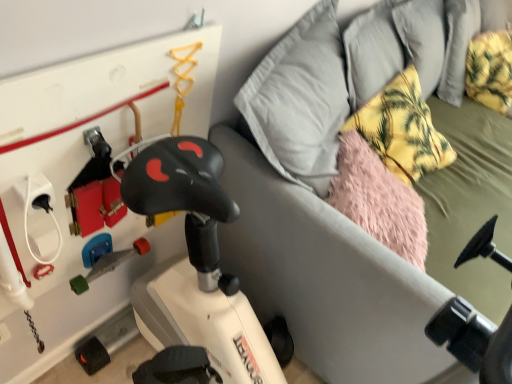
Question: Would you say yellow fabric pillow at upper right is outside white matte exercise bike at lower left?

Choices:
 (A) no
 (B) yes

Answer: (A)

Question: Is white matte exercise bike at lower left at the back of yellow fabric pillow at upper right?

Choices:
 (A) no
 (B) yes

Answer: (B)

Question: Considering the relative sizes of yellow fabric pillow at upper right and white matte exercise bike at lower left in the image provided, is yellow fabric pillow at upper right thinner than white matte exercise bike at lower left?

Choices:
 (A) no
 (B) yes

Answer: (B)

Question: Are yellow fabric pillow at upper right and white matte exercise bike at lower left located far from each other?

Choices:
 (A) yes
 (B) no

Answer: (B)

Question: From a real-world perspective, is yellow fabric pillow at upper right positioned under white matte exercise bike at lower left based on gravity?

Choices:
 (A) no
 (B) yes

Answer: (A)

Question: Is white matte exercise bike at lower left inside yellow fabric pillow at upper right?

Choices:
 (A) no
 (B) yes

Answer: (A)

Question: Is white matte exercise bike at lower left facing away from yellow fabric pillow at upper right?

Choices:
 (A) no
 (B) yes

Answer: (B)

Question: Considering the relative sizes of white matte exercise bike at lower left and yellow fabric pillow at upper right in the image provided, is white matte exercise bike at lower left shorter than yellow fabric pillow at upper right?

Choices:
 (A) yes
 (B) no

Answer: (B)

Question: Is white matte exercise bike at lower left not within yellow fabric pillow at upper right?

Choices:
 (A) yes
 (B) no

Answer: (A)

Question: Does white matte exercise bike at lower left have a greater width compared to yellow fabric pillow at upper right?

Choices:
 (A) no
 (B) yes

Answer: (B)

Question: From the image's perspective, is white matte exercise bike at lower left located beneath yellow fabric pillow at upper right?

Choices:
 (A) no
 (B) yes

Answer: (B)

Question: Is there a large distance between white matte exercise bike at lower left and yellow fabric pillow at upper right?

Choices:
 (A) no
 (B) yes

Answer: (A)

Question: Based on their positions, is white matte exercise bike at lower left located to the left or right of yellow fabric pillow at upper right?

Choices:
 (A) left
 (B) right

Answer: (B)